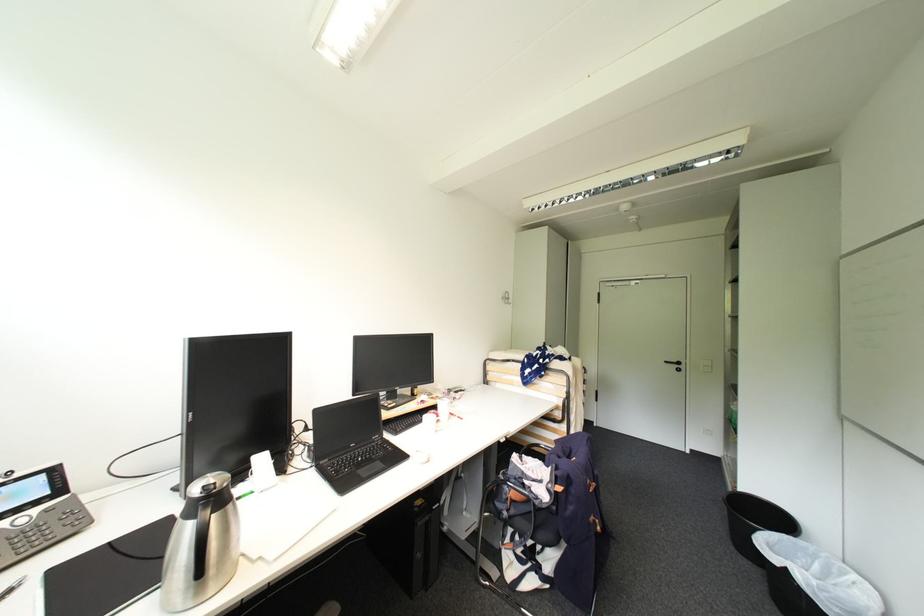
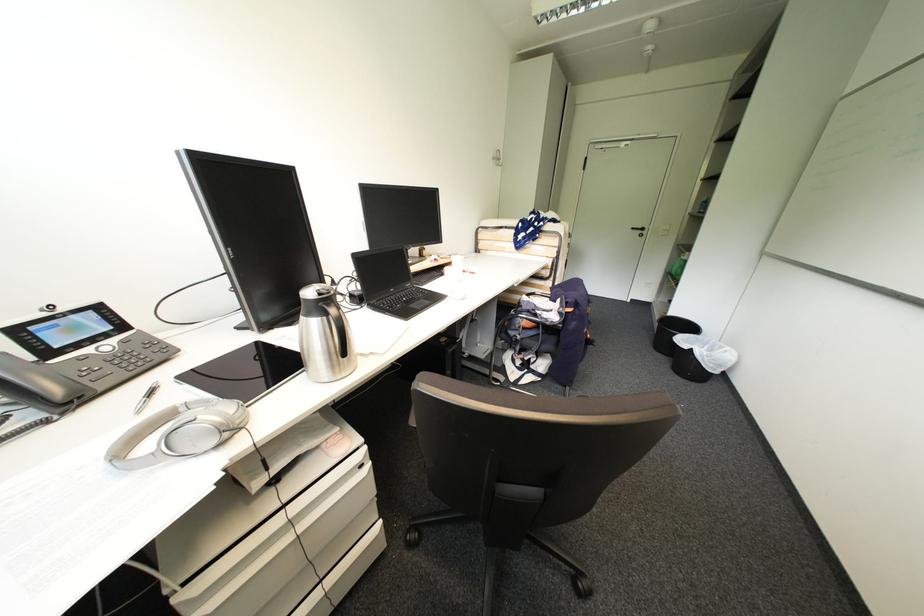
In the second image, find the point that corresponds to (x=772, y=573) in the first image.

(677, 359)